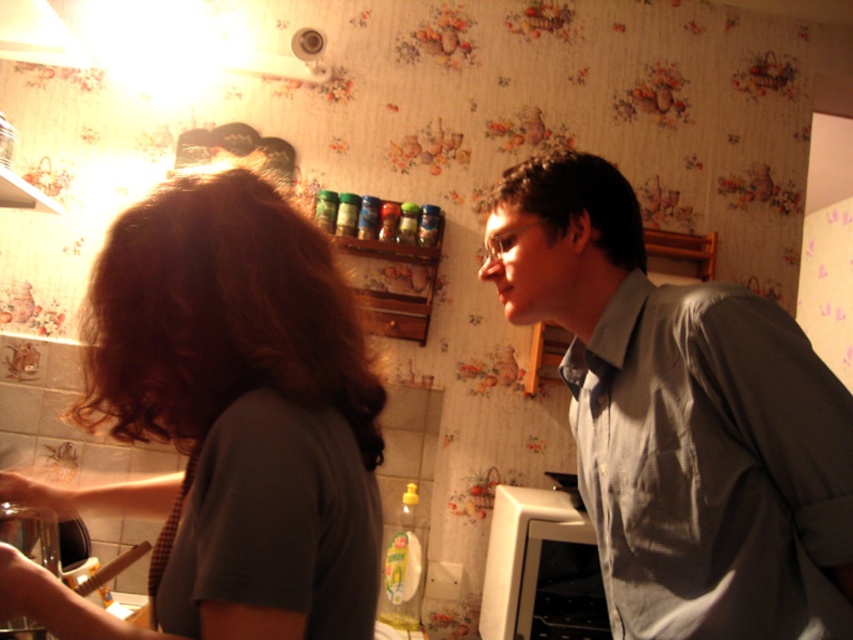
Question: Does dark brown hair at left have a greater width compared to white matte oven at lower right?

Choices:
 (A) yes
 (B) no

Answer: (A)

Question: Which point is farther to the camera?

Choices:
 (A) (491, 577)
 (B) (590, 221)
 (C) (119, 422)

Answer: (A)

Question: Does dark brown hair at left have a smaller size compared to white plastic exhaust hood at upper left?

Choices:
 (A) yes
 (B) no

Answer: (B)

Question: Does dark brown hair at left appear on the right side of gray cotton shirt at right?

Choices:
 (A) yes
 (B) no

Answer: (B)

Question: Which point is closer to the camera taking this photo?

Choices:
 (A) (335, 358)
 (B) (561, 529)
 (C) (42, 29)
 (D) (602, 275)

Answer: (A)

Question: Which point is farther from the camera taking this photo?

Choices:
 (A) (553, 497)
 (B) (39, 0)
 (C) (755, 321)

Answer: (A)